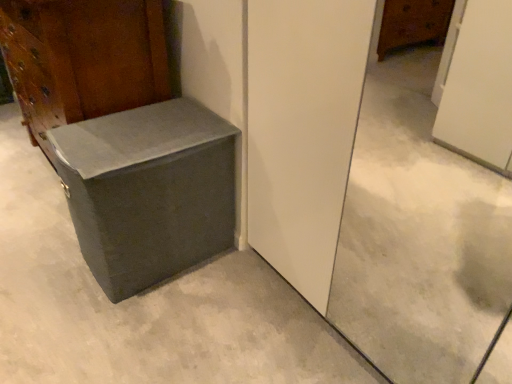
Question: Is matte gray cardboard box at lower left outside gray concrete at center?

Choices:
 (A) no
 (B) yes

Answer: (B)

Question: Considering the relative positions of matte gray cardboard box at lower left and gray concrete at center in the image provided, is matte gray cardboard box at lower left behind gray concrete at center?

Choices:
 (A) no
 (B) yes

Answer: (B)

Question: Is matte gray cardboard box at lower left thinner than gray concrete at center?

Choices:
 (A) no
 (B) yes

Answer: (B)

Question: From the image's perspective, is matte gray cardboard box at lower left over gray concrete at center?

Choices:
 (A) no
 (B) yes

Answer: (B)

Question: From a real-world perspective, is matte gray cardboard box at lower left beneath gray concrete at center?

Choices:
 (A) no
 (B) yes

Answer: (A)

Question: Is matte gray cardboard box at lower left smaller than gray concrete at center?

Choices:
 (A) no
 (B) yes

Answer: (B)

Question: Are gray concrete at center and matte gray trunk at lower left located far from each other?

Choices:
 (A) yes
 (B) no

Answer: (B)

Question: Is gray concrete at center positioned before matte gray trunk at lower left?

Choices:
 (A) no
 (B) yes

Answer: (B)

Question: Can you confirm if gray concrete at center is thinner than matte gray trunk at lower left?

Choices:
 (A) yes
 (B) no

Answer: (B)

Question: Is gray concrete at center completely or partially outside of matte gray trunk at lower left?

Choices:
 (A) yes
 (B) no

Answer: (A)

Question: Is gray concrete at center to the left of matte gray trunk at lower left from the viewer's perspective?

Choices:
 (A) yes
 (B) no

Answer: (A)

Question: Is gray concrete at center shorter than matte gray trunk at lower left?

Choices:
 (A) no
 (B) yes

Answer: (B)

Question: Is matte gray cardboard box at lower left at the right side of matte gray trunk at lower left?

Choices:
 (A) no
 (B) yes

Answer: (B)